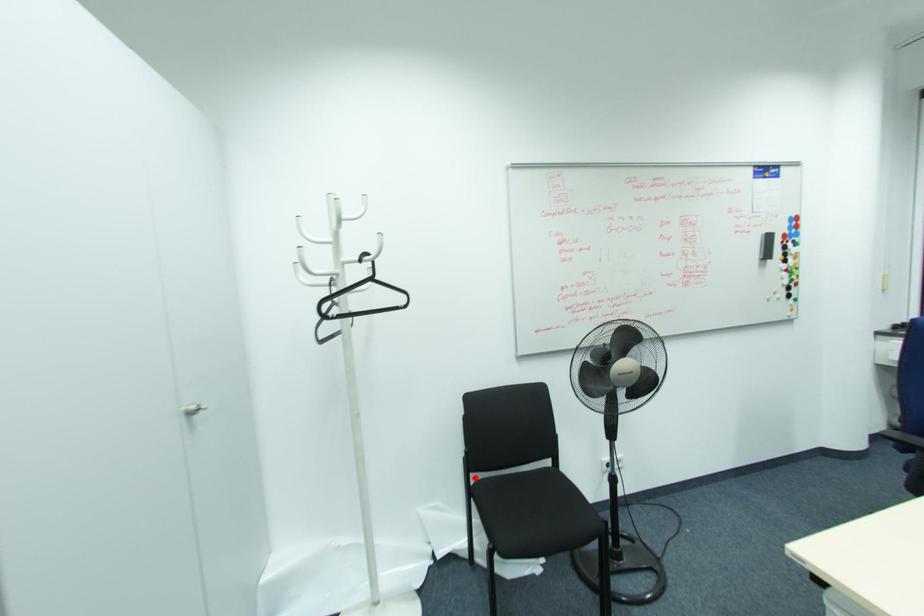
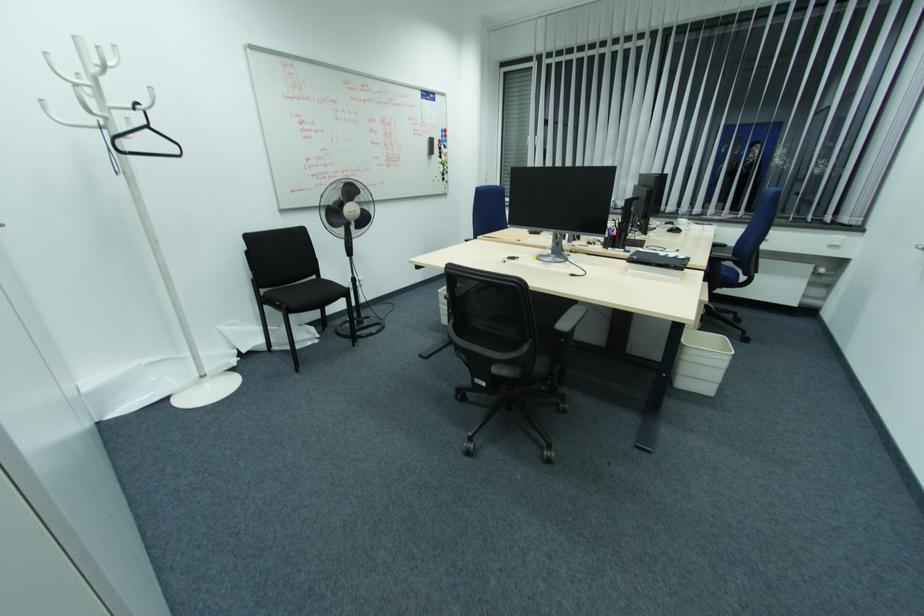
Find the pixel in the second image that matches the highlighted location in the first image.

(262, 291)